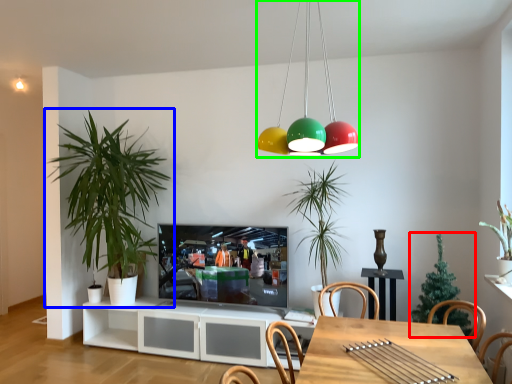
Question: Which object is positioned farthest from houseplant (highlighted by a red box)? Select from houseplant (highlighted by a blue box) and chandelier (highlighted by a green box).

Choices:
 (A) houseplant
 (B) chandelier

Answer: (A)